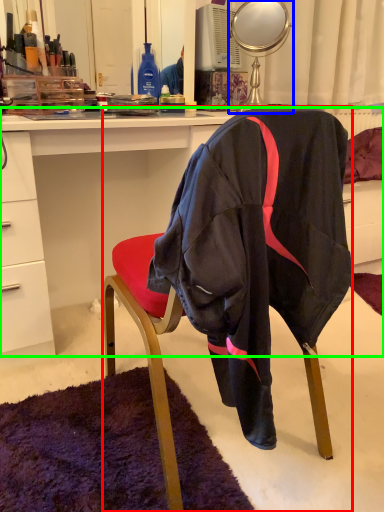
Question: Which object is the farthest from chair (highlighted by a red box)? Choose among these: mirror (highlighted by a blue box) or desk (highlighted by a green box).

Choices:
 (A) mirror
 (B) desk

Answer: (A)